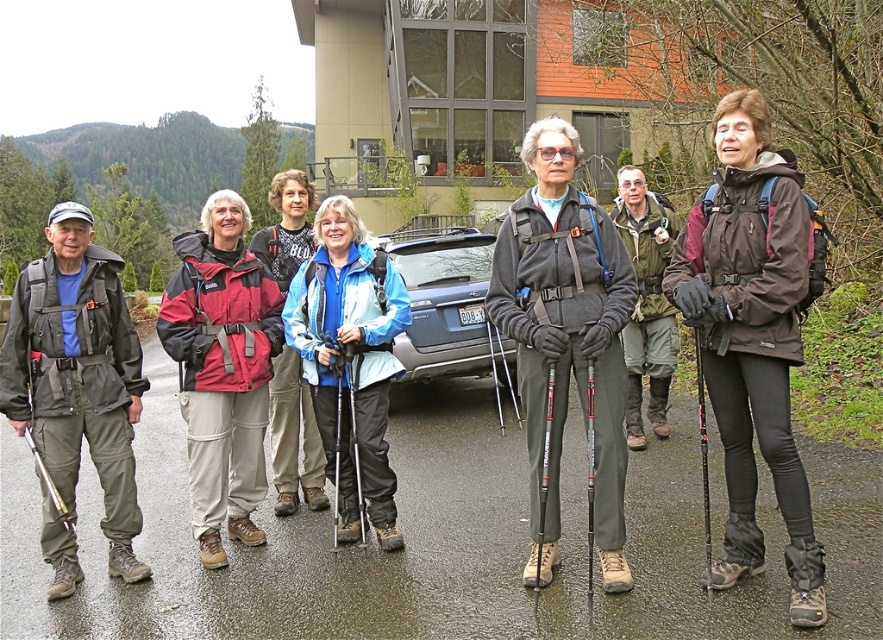
You are standing at the center of the paved area and want to locate the metallic gray suv at center. According to the coordinates provided, in which direction should you look relative to your position?

The metallic gray suv at center is located at coordinates point (447, 305). Since the coordinates are close to the center point of the image, you should look straight ahead to locate it.

You are a photographer trying to capture a clear shot of the brown matte jacket at center and the black textured ski pole at right. Since the group is blocking the view, you need to adjust your position. Which object should you move towards to ensure both are visible without obstruction?

The brown matte jacket at center is in front of the black textured ski pole at right. To ensure both are visible without obstruction, you should move towards the brown matte jacket at center so that it doesn not block the view of the ski pole behind it.

You are standing at the point labeled as point (391,355) in the image. You want to walk to the blue vehicle parked behind the group. Considering the distance between you and the viewer, can you estimate how far you need to walk to reach the blue vehicle?

The point labeled point (391,355) is 4.82 meters away from the viewer. However, the blue vehicle is parked behind the group, so the distance to the vehicle would depend on the group members and the vehicle position. Without additional information about the group members and vehicle location relative to the point, an accurate estimate cannot be provided.